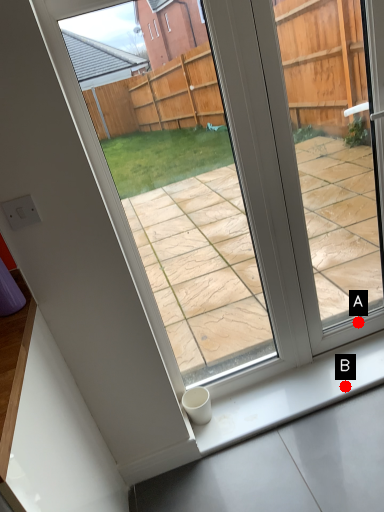
Question: Two points are circled on the image, labeled by A and B beside each circle. Which point is closer to the camera taking this photo?

Choices:
 (A) A is closer
 (B) B is closer

Answer: (B)